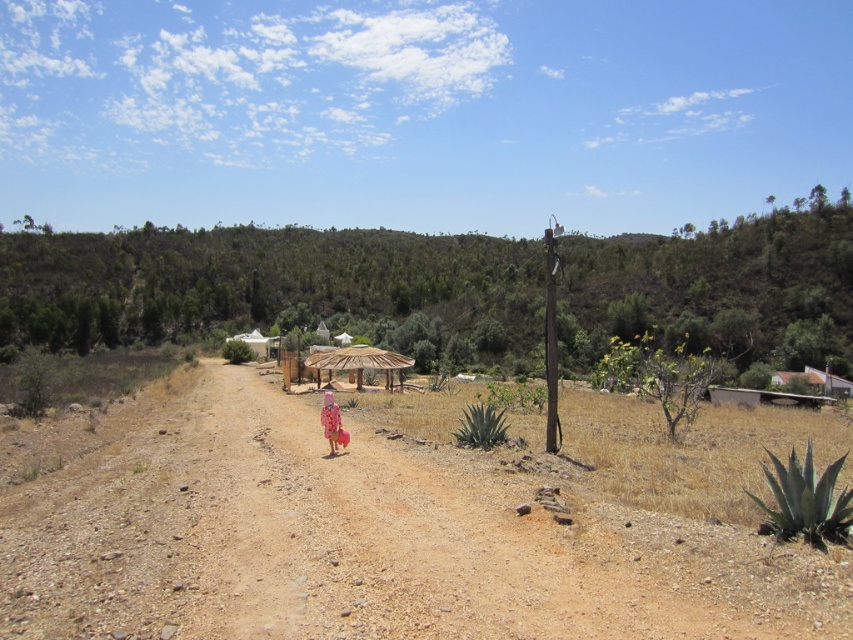
Is brown gravelly dirt field at center above pink fabric dress at center?

Actually, brown gravelly dirt field at center is below pink fabric dress at center.

How far apart are brown gravelly dirt field at center and pink fabric dress at center?

5.08 meters

Does point (650, 573) lie behind point (339, 412)?

No.

The height and width of the screenshot is (640, 853). What are the coordinates of `brown gravelly dirt field at center` in the screenshot? It's located at (357, 540).

Can you confirm if brown gravelly dirt field at center is thinner than natural straw umbrella at center?

No, brown gravelly dirt field at center is not thinner than natural straw umbrella at center.

Measure the distance between brown gravelly dirt field at center and camera.

They are 6.11 meters apart.

Where is `brown gravelly dirt field at center`? Image resolution: width=853 pixels, height=640 pixels. brown gravelly dirt field at center is located at coordinates (357, 540).

Between natural straw umbrella at center and pink fabric dress at center, which one has less height?

Standing shorter between the two is pink fabric dress at center.

Image resolution: width=853 pixels, height=640 pixels. Find the location of `natural straw umbrella at center`. natural straw umbrella at center is located at coordinates (358, 358).